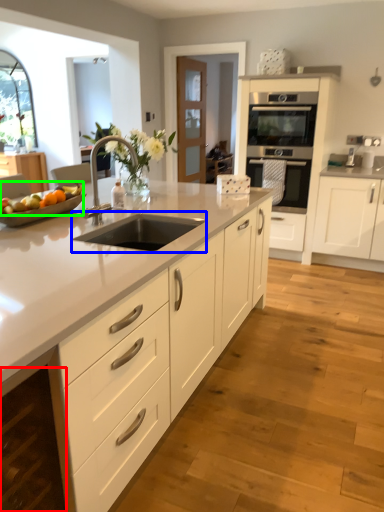
Question: Considering the real-world distances, which object is farthest from cabinetry (highlighted by a red box)? open (highlighted by a blue box) or fruit (highlighted by a green box)?

Choices:
 (A) open
 (B) fruit

Answer: (B)